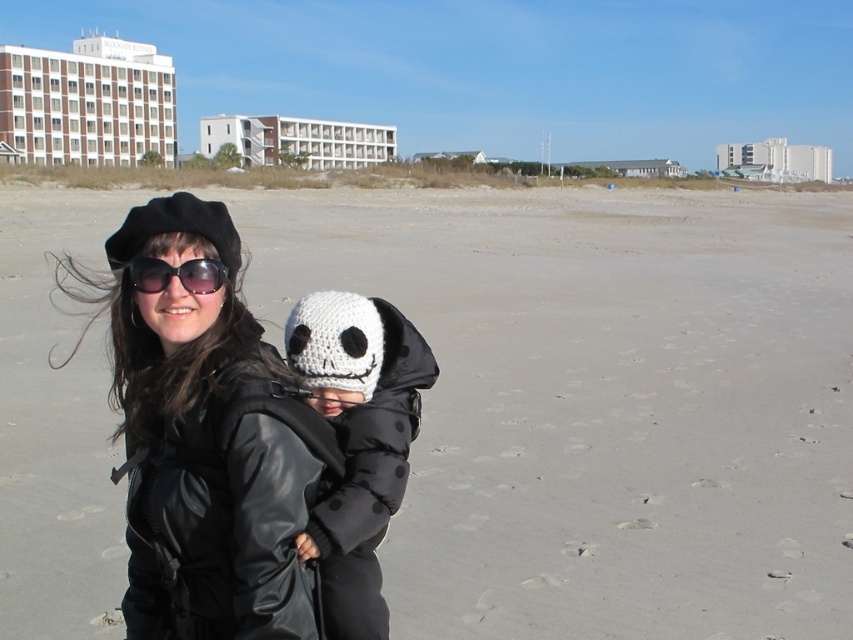
Which is behind, point (711, 337) or point (181, 243)?

Positioned behind is point (711, 337).

Does point (419, 579) come behind point (314, 454)?

That is True.

Find the location of `sandy beach at center`. sandy beach at center is located at coordinates (601, 401).

Is white knitted hat at center to the right of sunglasses at center from the viewer's perspective?

Correct, you'll find white knitted hat at center to the right of sunglasses at center.

Is white knitted hat at center below sunglasses at center?

Yes, white knitted hat at center is below sunglasses at center.

Locate an element on the screen. This screenshot has height=640, width=853. white knitted hat at center is located at coordinates (358, 442).

Is sandy beach at center taller than sunglasses at center?

Yes, sandy beach at center is taller than sunglasses at center.

This screenshot has height=640, width=853. I want to click on sandy beach at center, so click(x=601, y=401).

Locate an element on the screen. The width and height of the screenshot is (853, 640). sandy beach at center is located at coordinates (601, 401).